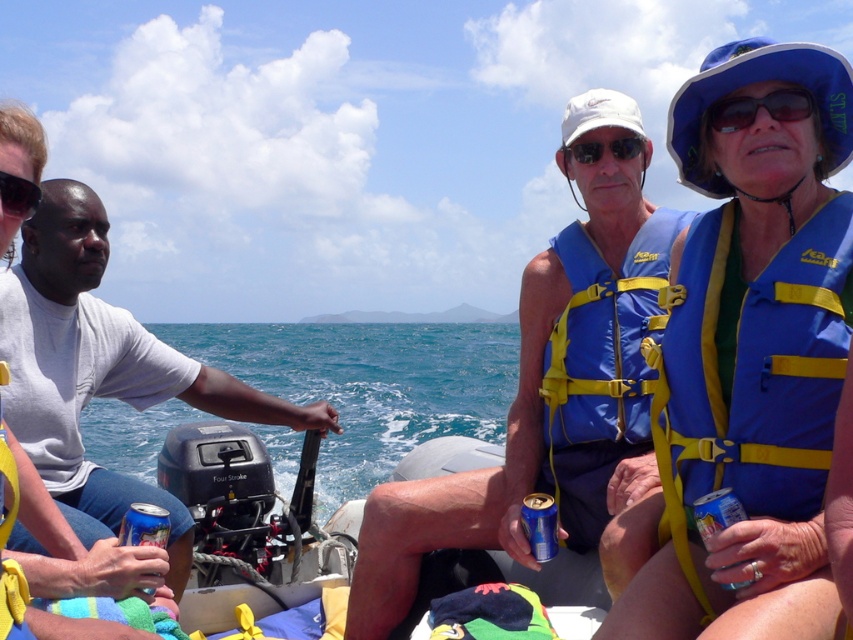
This screenshot has width=853, height=640. What do you see at coordinates (102, 371) in the screenshot? I see `white matte shirt at left` at bounding box center [102, 371].

The height and width of the screenshot is (640, 853). In order to click on white matte shirt at left in this screenshot , I will do `click(102, 371)`.

Is blue life vest at center right to the left of blue/yellow fabric life jacket at upper right from the viewer's perspective?

Indeed, blue life vest at center right is positioned on the left side of blue/yellow fabric life jacket at upper right.

Which is behind, point (529, 305) or point (780, 250)?

The point (529, 305) is behind.

Locate an element on the screen. The image size is (853, 640). blue life vest at center right is located at coordinates (549, 384).

Who is shorter, blue/yellow fabric life jacket at upper right or sunglassestransparent at upper right?

With less height is sunglassestransparent at upper right.

Is blue/yellow fabric life jacket at upper right to the left of sunglassestransparent at upper right from the viewer's perspective?

Correct, you'll find blue/yellow fabric life jacket at upper right to the left of sunglassestransparent at upper right.

I want to click on blue/yellow fabric life jacket at upper right, so click(x=751, y=369).

You are a GUI agent. You are given a task and a screenshot of the screen. Output one action in this format:
    pyautogui.click(x=<x>, y=<y>)
    Task: Click on the blue/yellow fabric life jacket at upper right
    This screenshot has height=640, width=853.
    Given the screenshot: What is the action you would take?
    pyautogui.click(x=751, y=369)